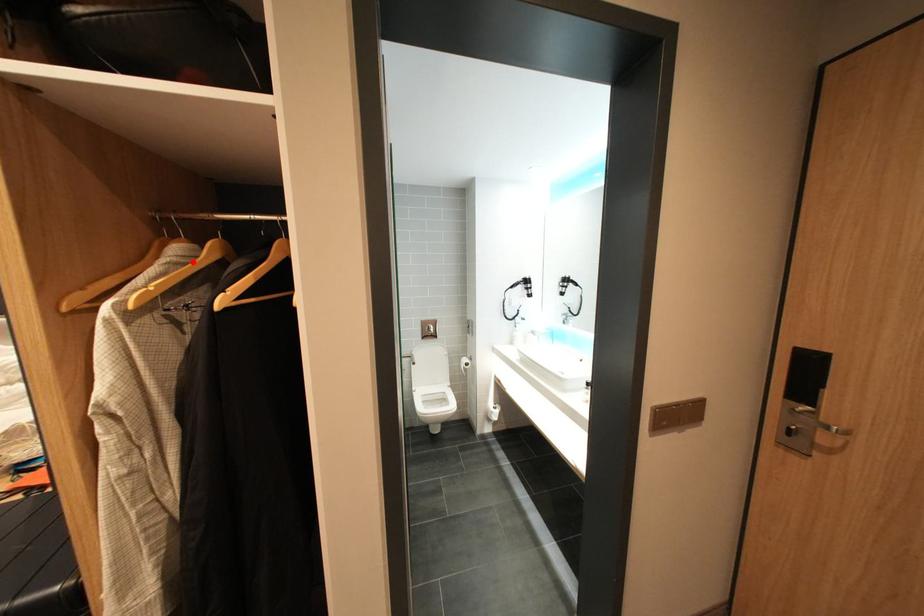
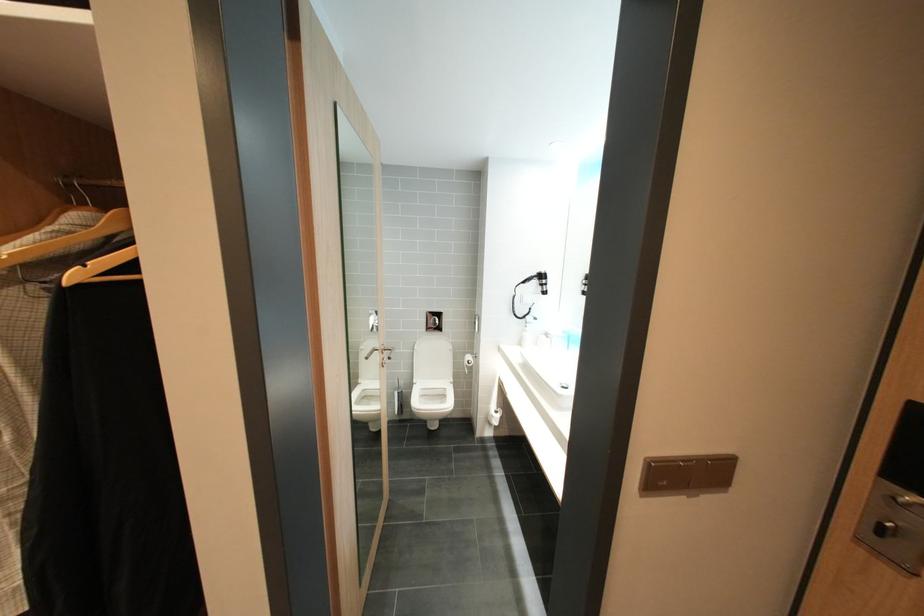
In the second image, find the point that corresponds to the highlighted location in the first image.

(91, 231)